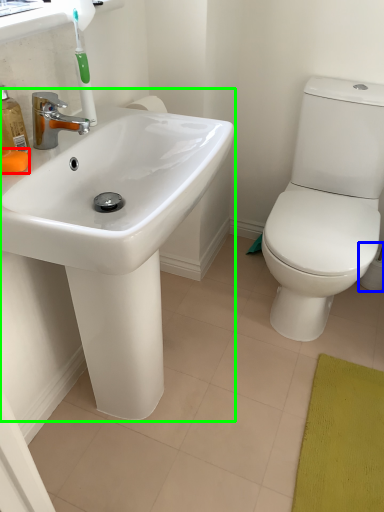
Question: Which is farther away from soap (highlighted by a red box)? toilet paper (highlighted by a blue box) or sink (highlighted by a green box)?

Choices:
 (A) toilet paper
 (B) sink

Answer: (A)